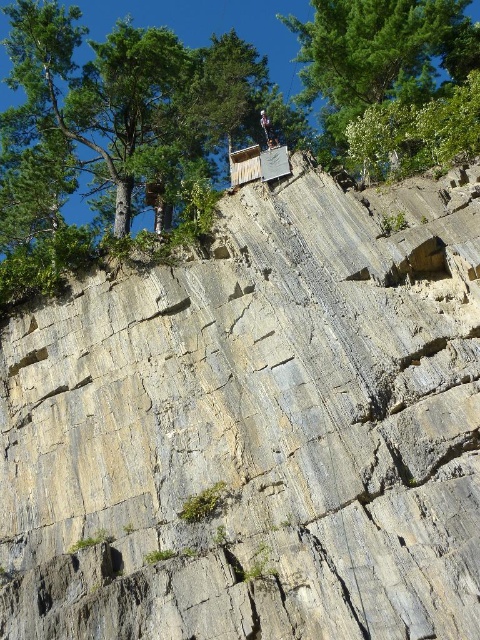
Consider the image. Who is shorter, green leafy tree at upper center or gray fabric rock climber at upper center?

Standing shorter between the two is gray fabric rock climber at upper center.

Is point (394, 16) closer to camera compared to point (264, 122)?

Yes.

The image size is (480, 640). I want to click on green leafy tree at upper center, so click(380, 54).